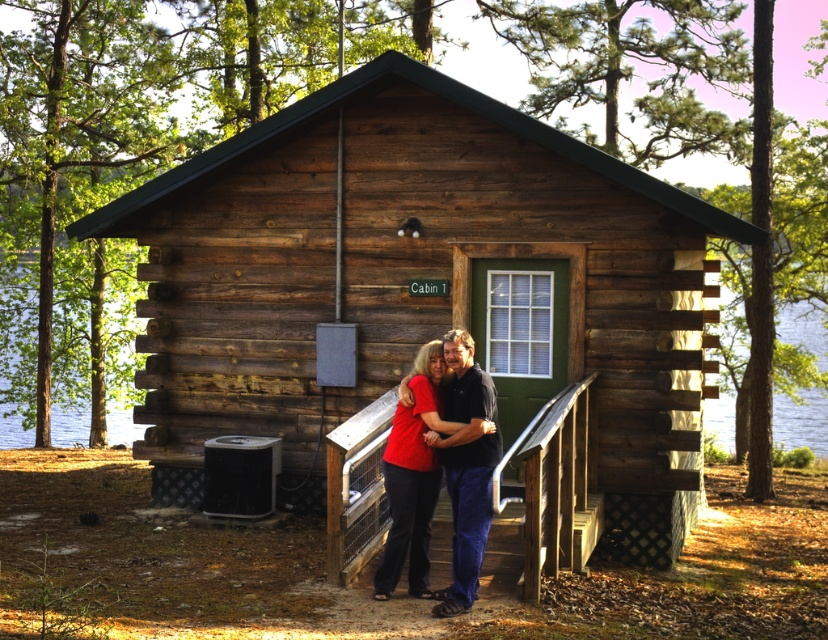
Question: Does transparent water at cabin left have a greater width compared to matte black couple at center?

Choices:
 (A) yes
 (B) no

Answer: (A)

Question: Which point is closer to the camera?

Choices:
 (A) (728, 358)
 (B) (691, 394)

Answer: (B)

Question: Is wooden cabin at center positioned behind transparent water at cabin right?

Choices:
 (A) yes
 (B) no

Answer: (B)

Question: Which object appears farthest from the camera in this image?

Choices:
 (A) transparent water at cabin right
 (B) matte black couple at center
 (C) wooden stairs at center

Answer: (A)

Question: Observing the image, what is the correct spatial positioning of transparent water at cabin left in reference to wooden stairs at center?

Choices:
 (A) left
 (B) right

Answer: (A)

Question: Among these points, which one is farthest from the camera?

Choices:
 (A) (783, 340)
 (B) (348, 440)
 (C) (100, 259)

Answer: (A)